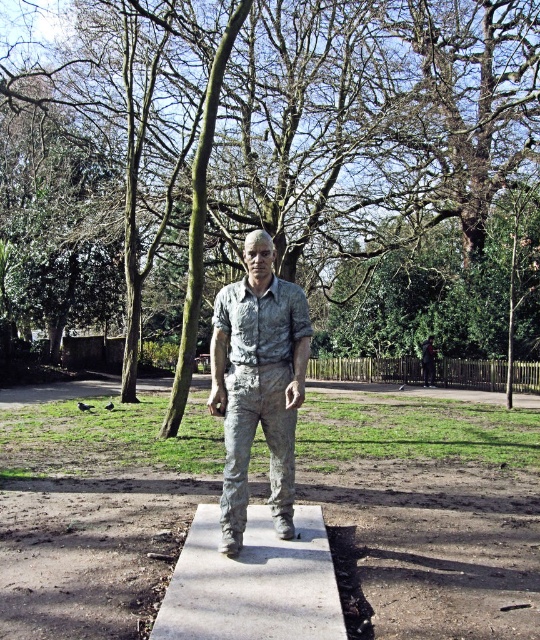
Question: Among these objects, which one is farthest from the camera?

Choices:
 (A) concreteroughconcrete at center
 (B) matte silver statue at center
 (C) green mossy tree at center
 (D) bronze statue at center

Answer: (B)

Question: Does bronze statue at center have a larger size compared to matte silver statue at center?

Choices:
 (A) yes
 (B) no

Answer: (B)

Question: Which point appears farthest from the camera in this image?

Choices:
 (A) (246, 620)
 (B) (145, 381)
 (C) (84, 186)
 (D) (249, 273)

Answer: (C)

Question: Can you confirm if green mossy tree at center is smaller than matte silver statue at center?

Choices:
 (A) no
 (B) yes

Answer: (A)

Question: Which of these objects is positioned closest to the bronze statue at center?

Choices:
 (A) concreteroughconcrete at center
 (B) matte silver statue at center

Answer: (A)

Question: Can you confirm if green mossy tree at center is wider than concreteroughconcrete at center?

Choices:
 (A) no
 (B) yes

Answer: (B)